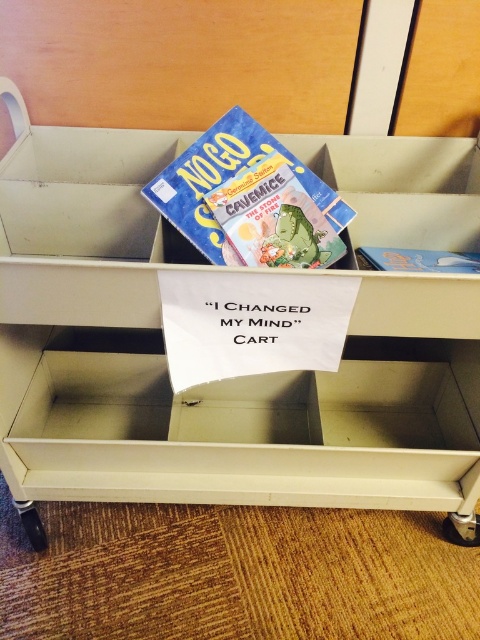
Question: Can you confirm if matte blue book at center is smaller than black rubber wheel at lower left?

Choices:
 (A) yes
 (B) no

Answer: (B)

Question: Among these points, which one is nearest to the camera?

Choices:
 (A) pos(304,474)
 (B) pos(196,168)
 (C) pos(456,529)

Answer: (B)

Question: Based on their relative distances, which object is nearer to the matte blue book at center?

Choices:
 (A) metallic silver wheel at lower right
 (B) black rubber wheel at lower left

Answer: (B)

Question: Does matte cardboard drawer at upper center appear on the left side of matte blue book at center?

Choices:
 (A) no
 (B) yes

Answer: (B)

Question: Which of the following is the closest to the observer?

Choices:
 (A) matte cardboard drawer at upper center
 (B) metallic silver wheel at lower right

Answer: (A)

Question: Is matte cardboard drawer at upper center above black rubber wheel at lower left?

Choices:
 (A) no
 (B) yes

Answer: (B)